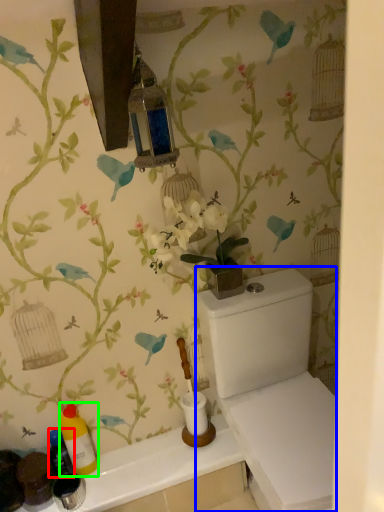
Question: Which is farther away from bottle (highlighted by a red box)? porcelain (highlighted by a blue box) or bottle (highlighted by a green box)?

Choices:
 (A) porcelain
 (B) bottle

Answer: (A)